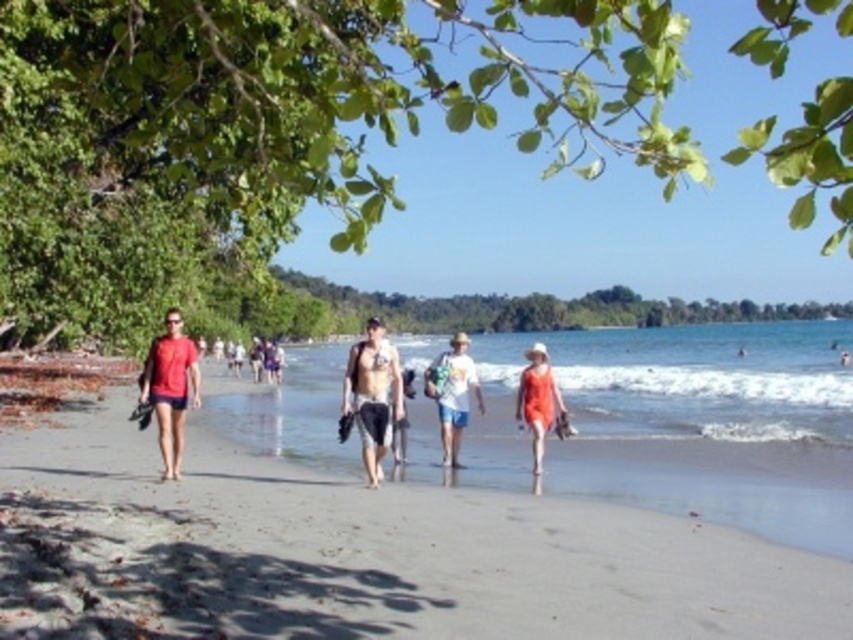
Question: Is matte red shirt at left below matte black shorts at center?

Choices:
 (A) yes
 (B) no

Answer: (B)

Question: Among these points, which one is nearest to the camera?

Choices:
 (A) (532, 420)
 (B) (560, 512)
 (C) (274, 355)

Answer: (B)

Question: Among these points, which one is farthest from the camera?

Choices:
 (A) pyautogui.click(x=376, y=406)
 (B) pyautogui.click(x=434, y=369)
 (C) pyautogui.click(x=537, y=396)
 (D) pyautogui.click(x=840, y=356)

Answer: (D)

Question: Which point is closer to the camera?

Choices:
 (A) (844, 360)
 (B) (456, 456)
 (C) (260, 353)

Answer: (B)

Question: In this image, where is tan skin at center located relative to matte red shirt at left?

Choices:
 (A) right
 (B) left

Answer: (A)

Question: Is matte black shorts at center wider than matte orange swimsuit at center?

Choices:
 (A) yes
 (B) no

Answer: (A)